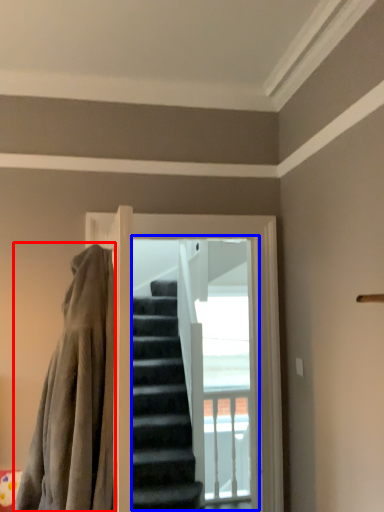
Question: Which point is closer to the camera, blanket (highlighted by a red box) or screen door (highlighted by a blue box)?

Choices:
 (A) blanket
 (B) screen door

Answer: (A)